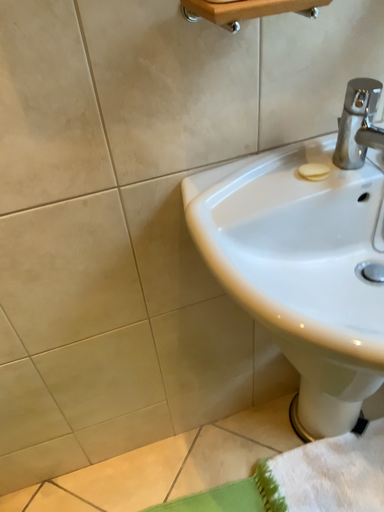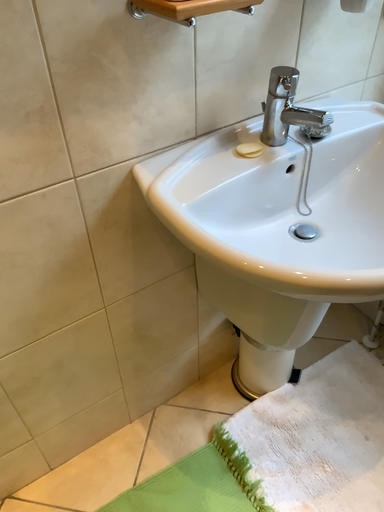
Question: How did the camera likely rotate when shooting the video?

Choices:
 (A) rotated right
 (B) rotated left

Answer: (A)